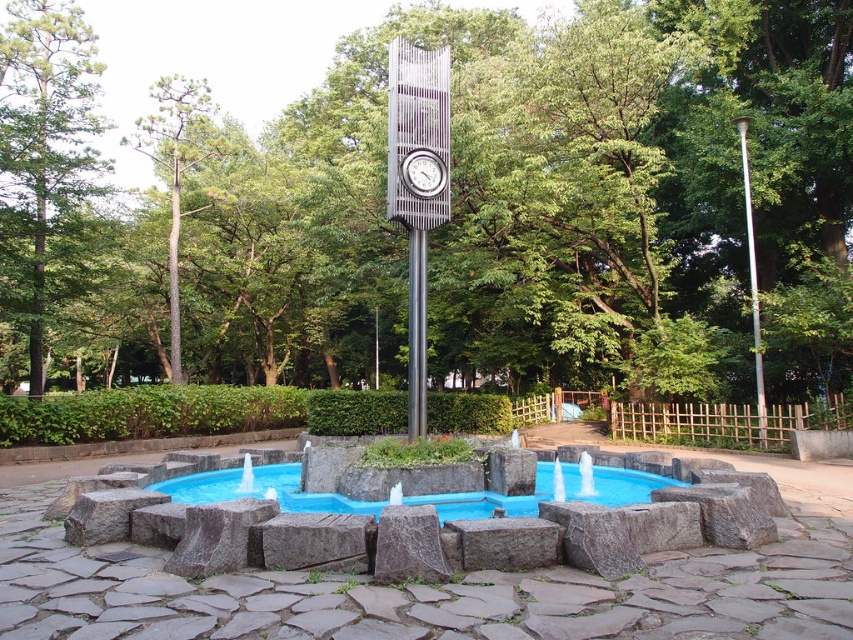
Is green leafy tree at left above silver metallic pole at upper right?

Indeed, green leafy tree at left is positioned over silver metallic pole at upper right.

Locate an element on the screen. This screenshot has width=853, height=640. green leafy tree at left is located at coordinates (47, 129).

The image size is (853, 640). What do you see at coordinates (47, 129) in the screenshot?
I see `green leafy tree at left` at bounding box center [47, 129].

At what (x,y) coordinates should I click in order to perform the action: click on green leafy tree at left. Please return your answer as a coordinate pair (x, y). The image size is (853, 640). Looking at the image, I should click on (47, 129).

Is blue granite pool at center smaller than green rough bark tree at left?

Yes.

Does point (454, 499) come behind point (183, 124)?

No, it is not.

Which is in front, point (577, 465) or point (183, 116)?

Point (577, 465) is more forward.

The image size is (853, 640). I want to click on blue granite pool at center, so click(260, 490).

Looking at this image, how distant is green leafy tree at left from green rough bark tree at left?

3.44 meters

Does green leafy tree at left have a smaller size compared to green rough bark tree at left?

Yes, green leafy tree at left is smaller than green rough bark tree at left.

Which is behind, point (59, 67) or point (183, 104)?

Positioned behind is point (183, 104).

The width and height of the screenshot is (853, 640). What are the coordinates of `green leafy tree at left` in the screenshot? It's located at (47, 129).